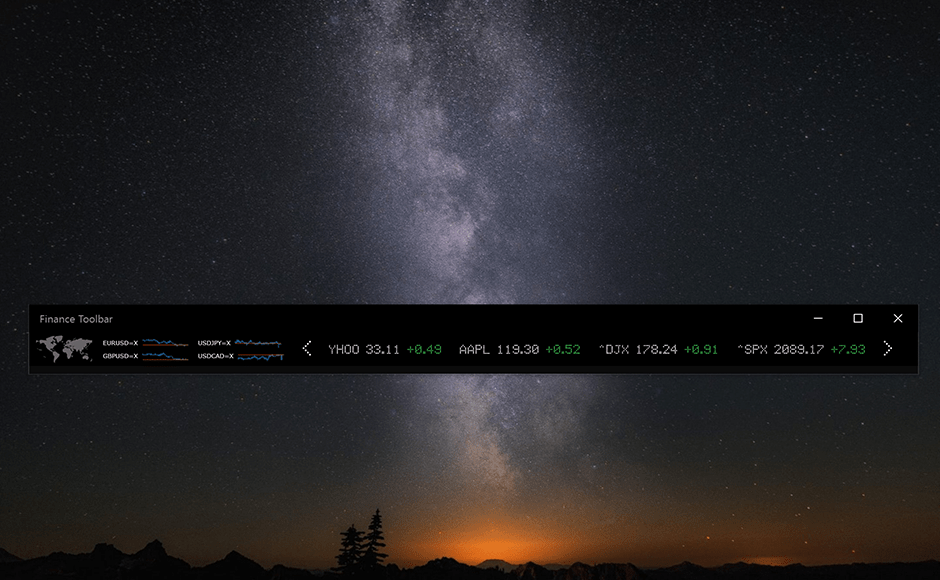
Where is `computer window`? The image size is (940, 580). computer window is located at coordinates tap(427, 314).